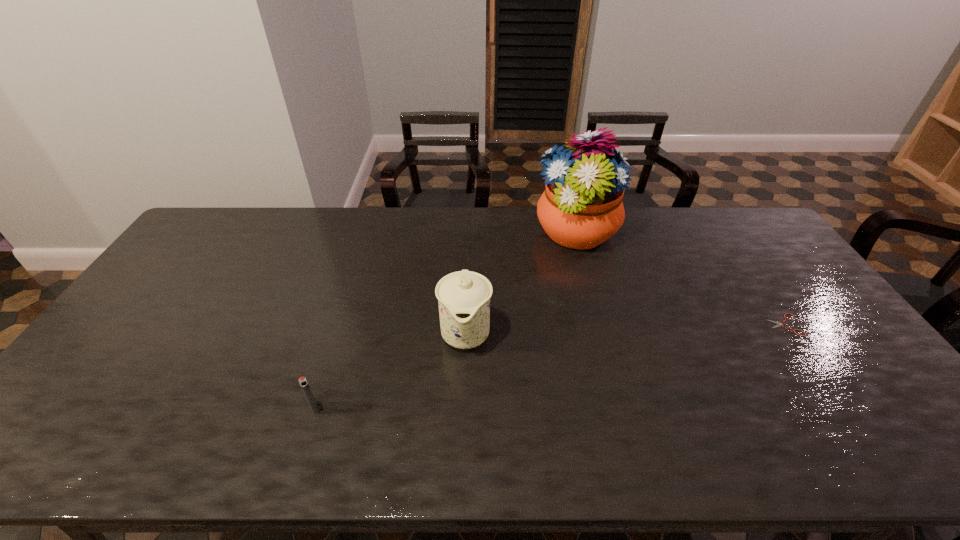
This screenshot has height=540, width=960. What are the coordinates of `empty space between the second shortest object and the shortest object` in the screenshot? It's located at (549, 367).

I want to click on blank region between the second tallest object and the shortest object, so click(x=625, y=328).

You are a GUI agent. You are given a task and a screenshot of the screen. Output one action in this format:
    pyautogui.click(x=<x>, y=<y>)
    Task: Click on the free spot between the igniter and the shears
    
    Given the screenshot: What is the action you would take?
    pyautogui.click(x=549, y=367)

The width and height of the screenshot is (960, 540). Identify the location of unoccupied position between the farthest object and the second object from left to right. (521, 283).

The width and height of the screenshot is (960, 540). Find the location of `vacant region between the shears and the chinaware`. vacant region between the shears and the chinaware is located at coordinates (625, 328).

Identify the location of blank region between the third object from left to right and the shortest object. (680, 280).

The width and height of the screenshot is (960, 540). In order to click on empty space that is in between the leftmost object and the shortest object in this screenshot , I will do `click(549, 367)`.

At what (x,y) coordinates should I click in order to perform the action: click on the closest object to the nearest object. Please return your answer as a coordinate pair (x, y). Looking at the image, I should click on (464, 296).

Identify the location of object that can be found as the closest to the chinaware. This screenshot has height=540, width=960. (581, 207).

Find the location of `vacant space that satisfies the following two spatial constraints: 1. on the front side of the second object from right to left; 2. on the left side of the rightmost object`. vacant space that satisfies the following two spatial constraints: 1. on the front side of the second object from right to left; 2. on the left side of the rightmost object is located at coordinates (601, 325).